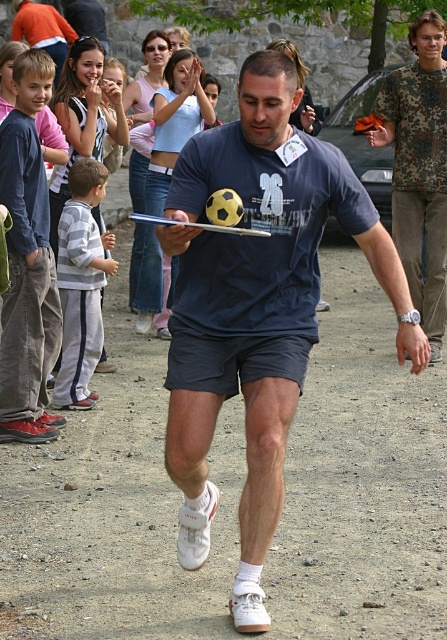
Is matte blue t-shirt at center bigger than light blue denim shorts at center?

Yes, matte blue t-shirt at center is bigger than light blue denim shorts at center.

Is the position of matte blue t-shirt at center more distant than that of light blue denim shorts at center?

No, matte blue t-shirt at center is closer to the viewer.

Does point (185, 410) come behind point (155, 97)?

No, (185, 410) is in front of (155, 97).

Where is `matte blue t-shirt at center`? The height and width of the screenshot is (640, 447). matte blue t-shirt at center is located at coordinates (257, 307).

Which is behind, point (79, 276) or point (184, 93)?

The point (184, 93) is more distant.

Which is below, gray/white track suit at left or light blue denim shorts at center?

gray/white track suit at left

Between point (79, 163) and point (155, 129), which one is positioned behind?

The point (155, 129) is behind.

What are the coordinates of `gray/white track suit at left` in the screenshot? It's located at (80, 284).

I want to click on camouflage fabric shirt at right, so click(x=420, y=170).

Which is behind, point (438, 67) or point (152, 291)?

Point (152, 291)

Between point (413, 28) and point (143, 321), which one is positioned in front?

Point (413, 28) is more forward.

Identify the location of camouflage fabric shirt at right. This screenshot has width=447, height=640. (420, 170).